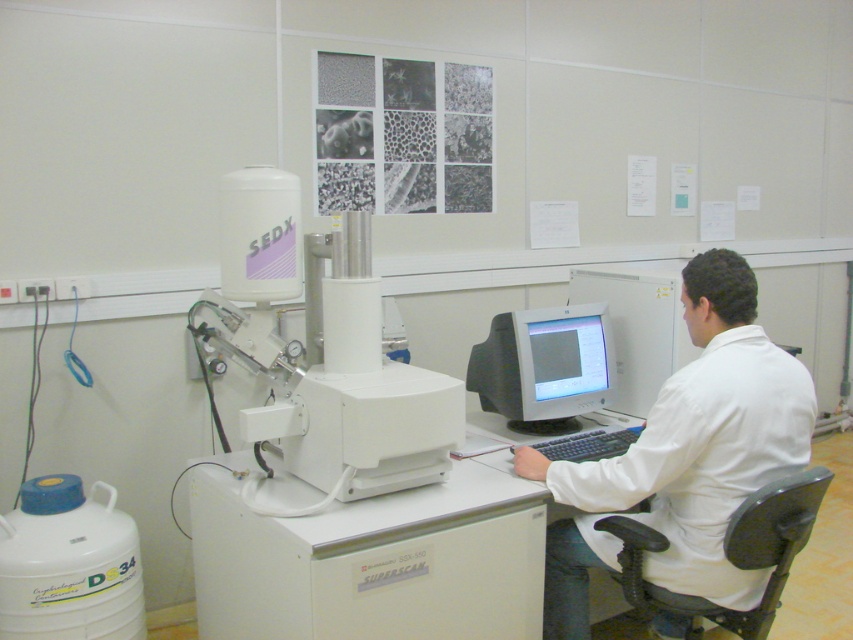
In the scene shown: You are a visitor in the lab and need to locate the person wearing the white lab coat at center. According to the scene, where would you find them relative to the matte gray monitor at center?

The white lab coat at center is located below the matte gray monitor at center, so the person is sitting in front of the monitor at a lower position.

You are a researcher in the lab and need to place a heavy sample on the white plastic table at center without blocking the view of the matte gray monitor at center. Is the table positioned in a way that allows this?

The white plastic table at center is located below the matte gray monitor at center, so placing the sample on the table would not block the monitor since it is positioned beneath it.